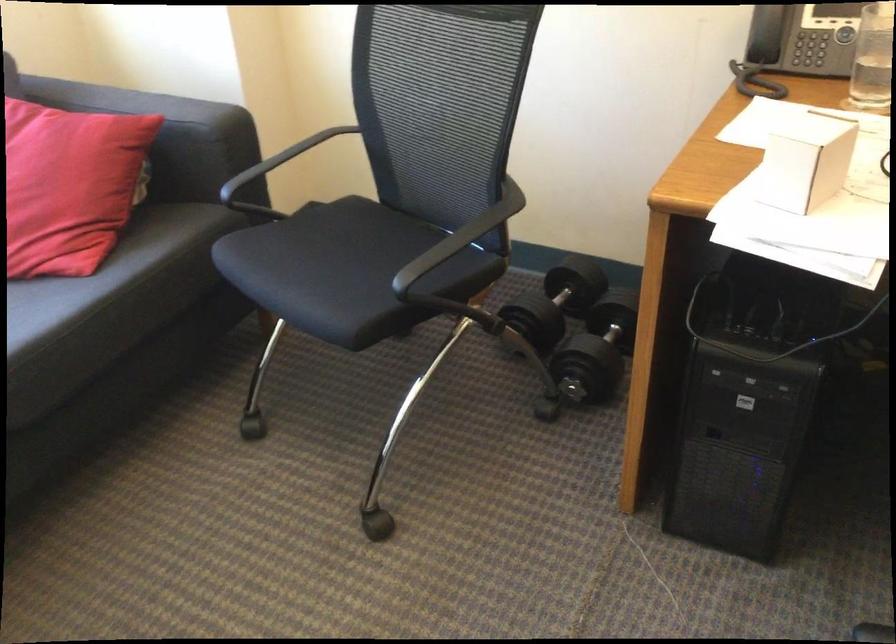
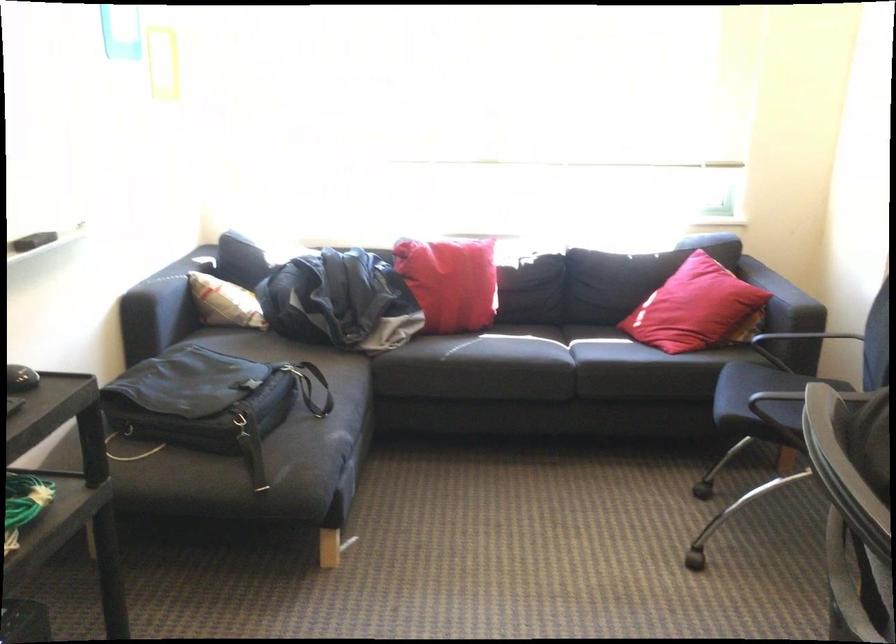
In the second image, find the point that corresponds to pixel 243 167 in the first image.

(802, 337)